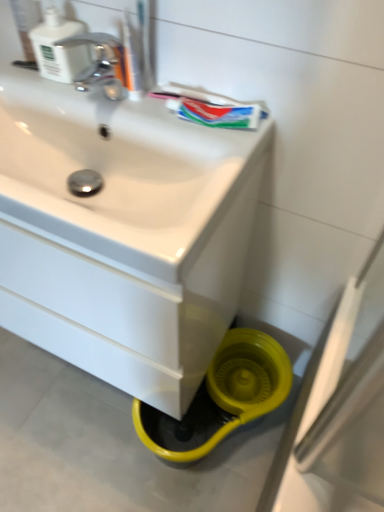
Locate an element on the screen. vacant space that is to the left of translucent plastic toothbrush at upper center is located at coordinates (75, 89).